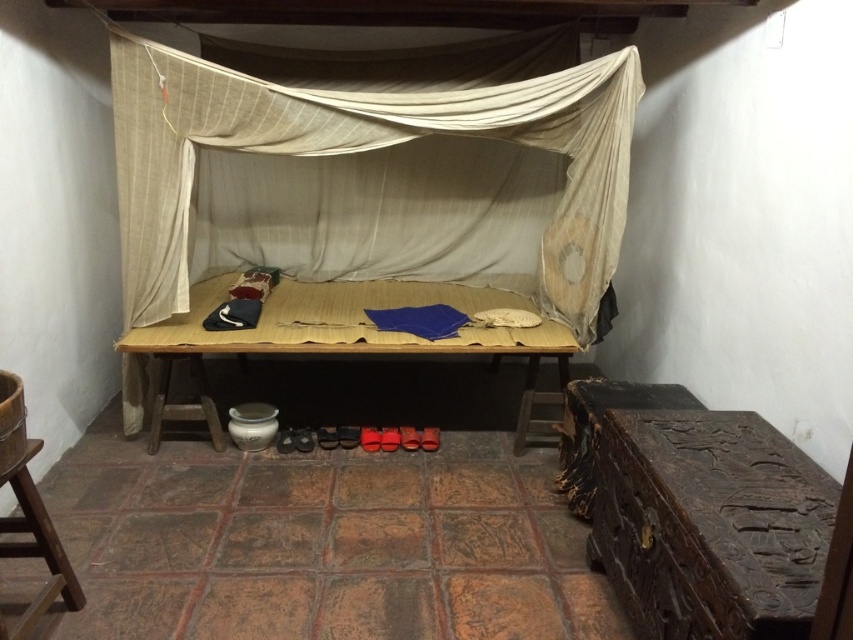
Which of these two, beige fabric canopy bed at center or wooden table at center, stands shorter?

wooden table at center is shorter.

Can you confirm if beige fabric canopy bed at center is shorter than wooden table at center?

Incorrect, beige fabric canopy bed at center's height does not fall short of wooden table at center's.

Does point (141, 106) come closer to viewer compared to point (289, 296)?

Yes.

This screenshot has height=640, width=853. Identify the location of beige fabric canopy bed at center. coord(372,180).